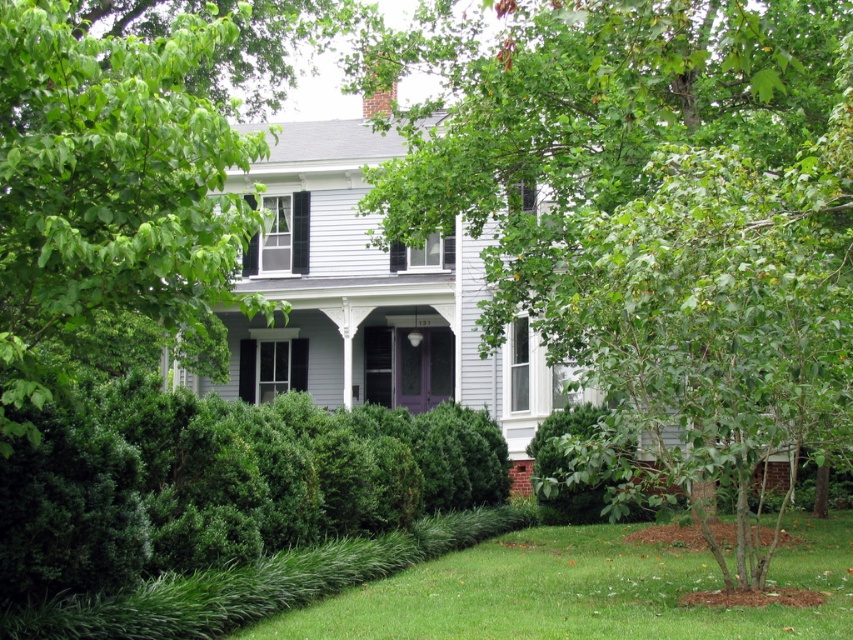
Based on the photo, you are standing at the front door of the house and looking down at the green grass at lower center and the green leafy hedge at lower center. Which one is shorter?

The green grass at lower center is shorter than the green leafy hedge at lower center.

Consider the image. You are a gardener planning to install a new sprinkler system between the green grass at lower center and the green leafy hedge at lower center. What is the minimum distance the sprinkler needs to cover to reach both areas?

The distance between the green grass at lower center and the green leafy hedge at lower center is 20.77 feet, so the sprinkler must be able to cover at least 20.77 feet to reach both areas.